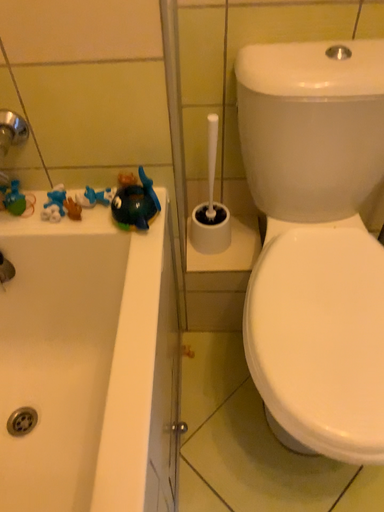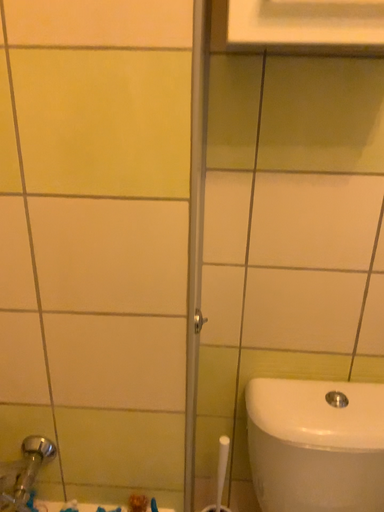
Question: How did the camera likely rotate when shooting the video?

Choices:
 (A) rotated downward
 (B) rotated upward

Answer: (B)